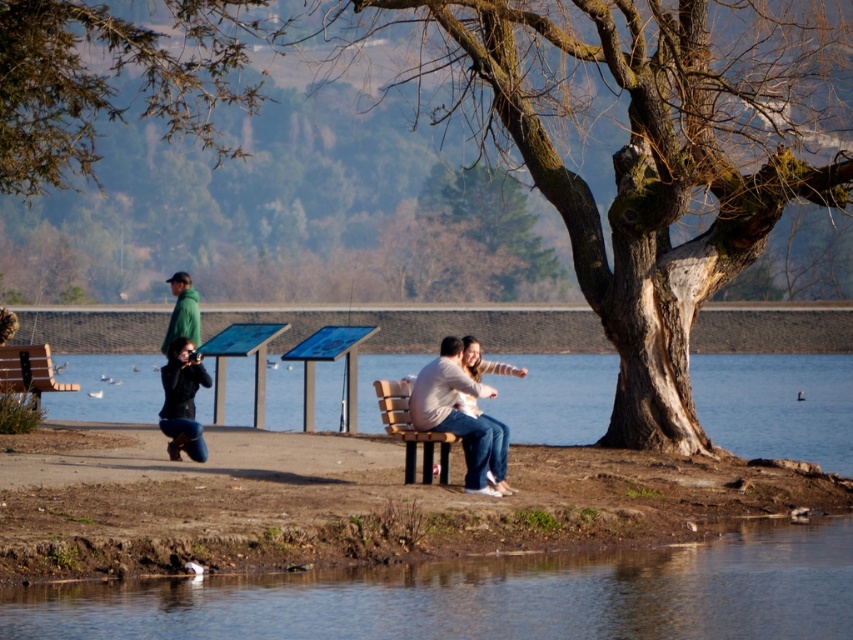
You are standing at the wooden bench where the couple is sitting. You want to walk to the clear blue water at bench right. Which direction should you walk to reach it?

The clear blue water at bench right is located at point (x=776, y=404), so you should walk towards the right side of the bench to reach it.

You are standing in the lakeside scene and want to place a small decorative rock between the two points labeled point (x=389, y=369) and point (x=177, y=300). Which point should the rock be closer to if you want it to appear larger in your photo?

The rock should be placed closer to point (x=177, y=300) because objects closer to the camera appear larger. Since point (x=389, y=369) is further away, placing the rock near the nearer point (x=177, y=300) will make it look bigger in the photo.